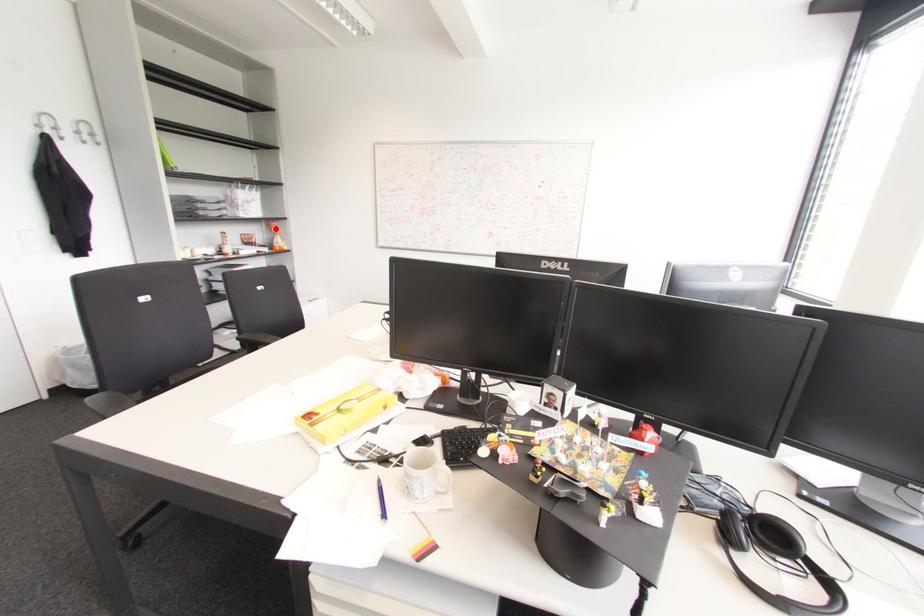
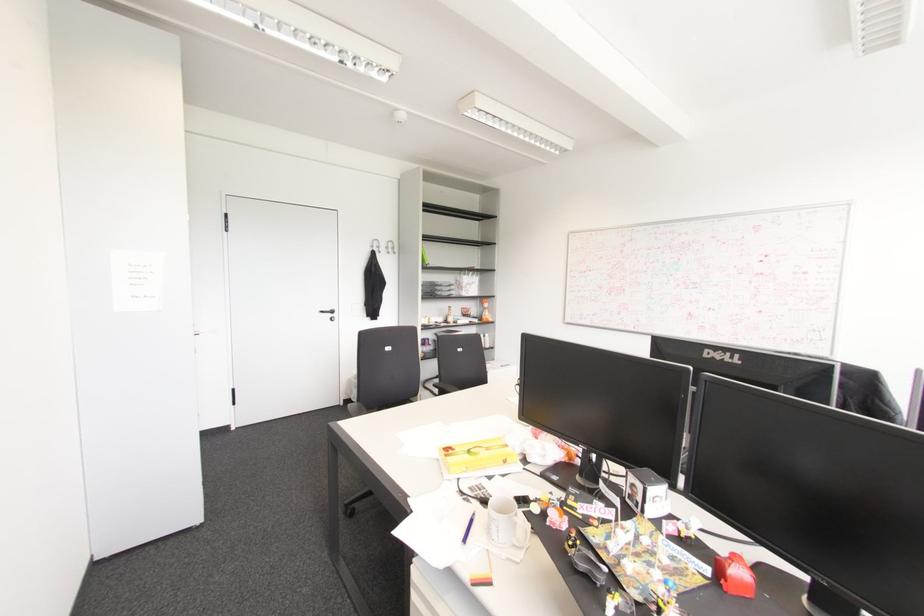
In the second image, find the point that corresponds to the highlighted location in the first image.

(485, 305)